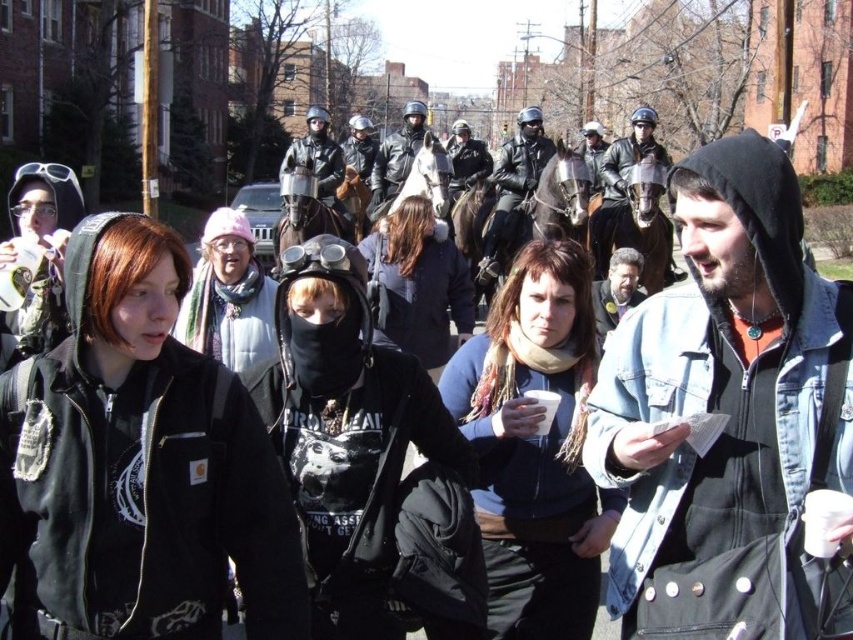
Which of these two, shiny black helmet at center or dark brown leather jacket at center, stands shorter?

dark brown leather jacket at center

Is shiny black helmet at center taller than dark brown leather jacket at center?

Indeed, shiny black helmet at center has a greater height compared to dark brown leather jacket at center.

Who is more forward, [605,237] or [602,321]?

Point [602,321] is more forward.

The width and height of the screenshot is (853, 640). I want to click on shiny black helmet at center, so click(621, 177).

Does shiny black leather jacket at center have a larger size compared to shiny black helmet at center?

Correct, shiny black leather jacket at center is larger in size than shiny black helmet at center.

Which of these two, shiny black leather jacket at center or shiny black helmet at center, stands taller?

shiny black leather jacket at center

Where is `shiny black leather jacket at center`? The height and width of the screenshot is (640, 853). shiny black leather jacket at center is located at coordinates (512, 188).

Between denim jacket at center and shiny black helmet at center, which one is positioned lower?

denim jacket at center is lower down.

Which is more to the left, denim jacket at center or shiny black helmet at center?

Positioned to the left is denim jacket at center.

At what (x,y) coordinates should I click in order to perform the action: click on denim jacket at center. Please return your answer as a coordinate pair (x, y). This screenshot has height=640, width=853. Looking at the image, I should click on (728, 417).